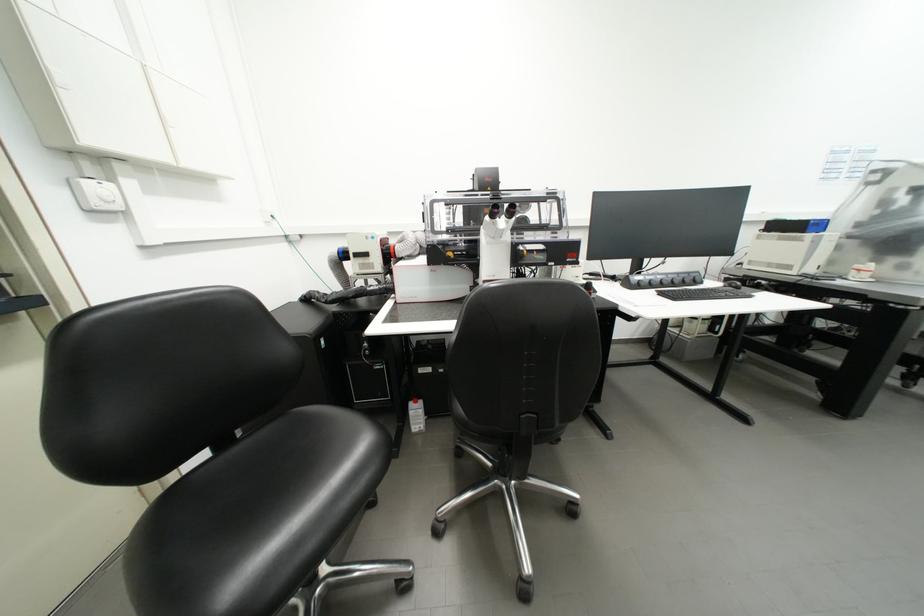
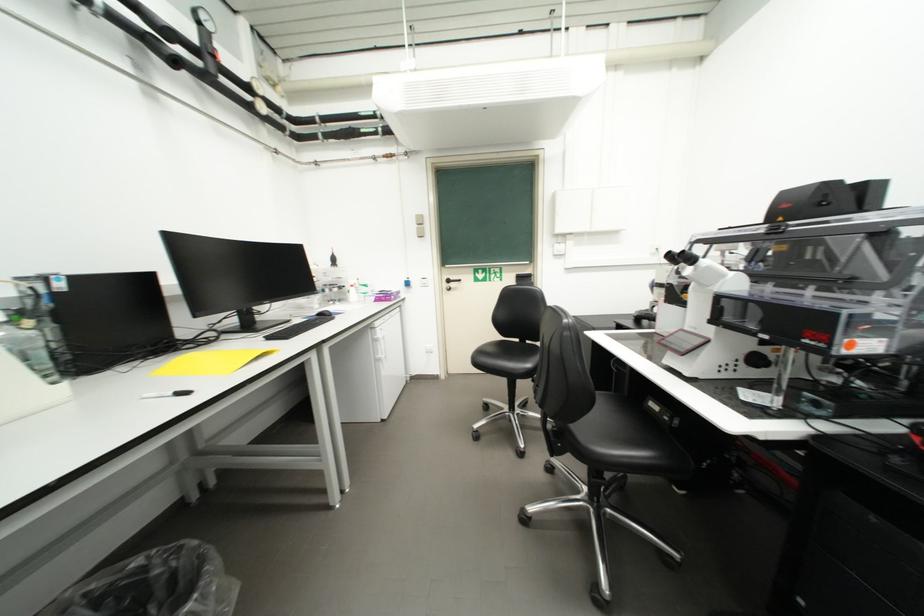
Locate, in the second image, the point that corresponds to [42,185] in the first image.

(553, 249)